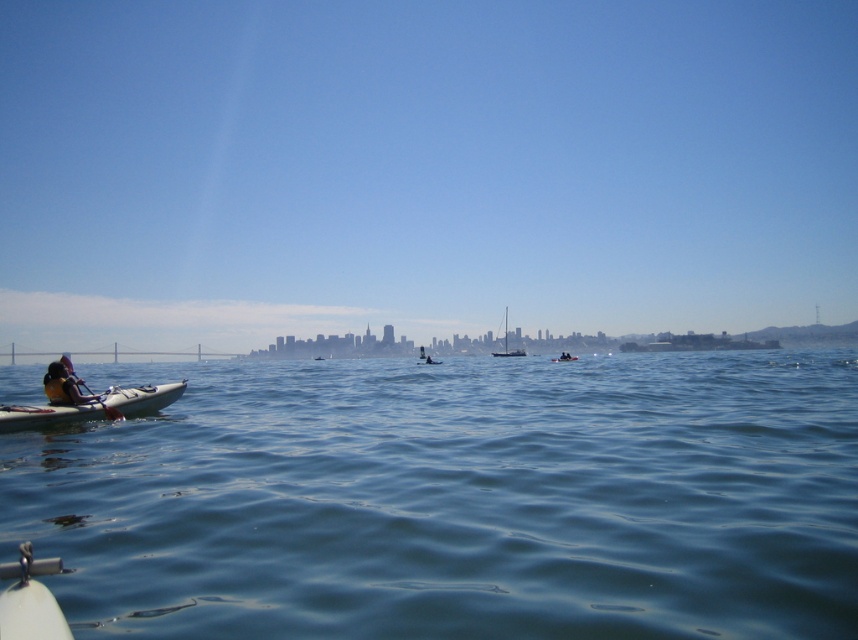
Question: Considering the real-world distances, which object is closest to the white plastic canoe at lower left?

Choices:
 (A) white matte kayak at center
 (B) white plastic kayak at center

Answer: (B)

Question: Does white plastic canoe at lower left lie in front of white plastic kayak at center?

Choices:
 (A) yes
 (B) no

Answer: (A)

Question: Which point is farther to the camera?

Choices:
 (A) blue water at center
 (B) white matte kayak at center

Answer: (B)

Question: Is white wooden sailboat at center below white matte kayak at center?

Choices:
 (A) yes
 (B) no

Answer: (A)

Question: Does blue water at center lie in front of white wooden sailboat at center?

Choices:
 (A) no
 (B) yes

Answer: (B)

Question: Which object appears closest to the camera in this image?

Choices:
 (A) white sailboat at center
 (B) blue water at center
 (C) white plastic kayak at center

Answer: (B)